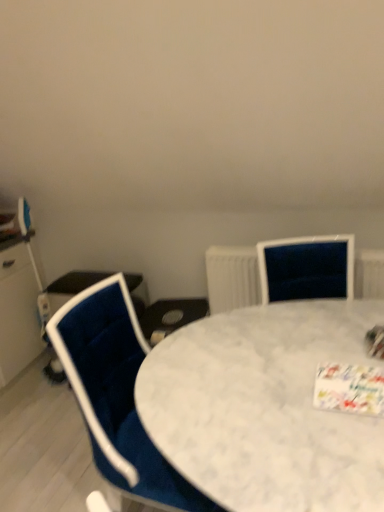
Question: From the image's perspective, is velvet blue chair at left on white marble table at center?

Choices:
 (A) no
 (B) yes

Answer: (B)

Question: From a real-world perspective, is velvet blue chair at left physically below white marble table at center?

Choices:
 (A) no
 (B) yes

Answer: (A)

Question: Can you confirm if velvet blue chair at left is thinner than white marble table at center?

Choices:
 (A) yes
 (B) no

Answer: (A)

Question: Is velvet blue chair at left further to camera compared to white marble table at center?

Choices:
 (A) no
 (B) yes

Answer: (B)

Question: Can you confirm if velvet blue chair at left is bigger than white marble table at center?

Choices:
 (A) no
 (B) yes

Answer: (A)

Question: Based on their sizes in the image, would you say white marble table at center is bigger or smaller than white textured radiator at upper right?

Choices:
 (A) small
 (B) big

Answer: (B)

Question: From a real-world perspective, is white marble table at center above or below white textured radiator at upper right?

Choices:
 (A) above
 (B) below

Answer: (B)

Question: Considering the positions of white marble table at center and white textured radiator at upper right in the image, is white marble table at center taller or shorter than white textured radiator at upper right?

Choices:
 (A) short
 (B) tall

Answer: (B)

Question: Considering the positions of white marble table at center and white textured radiator at upper right in the image, is white marble table at center wider or thinner than white textured radiator at upper right?

Choices:
 (A) thin
 (B) wide

Answer: (B)

Question: Is velvet blue chair at left spatially inside white marble table at center, or outside of it?

Choices:
 (A) inside
 (B) outside

Answer: (A)

Question: Looking at their shapes, would you say velvet blue chair at left is wider or thinner than white marble table at center?

Choices:
 (A) wide
 (B) thin

Answer: (B)

Question: Looking at the image, does velvet blue chair at left seem bigger or smaller compared to white marble table at center?

Choices:
 (A) small
 (B) big

Answer: (A)

Question: In the image, is velvet blue chair at left positioned in front of or behind white marble table at center?

Choices:
 (A) behind
 (B) front

Answer: (A)

Question: Is white textured radiator at upper right wider or thinner than velvet blue chair at left?

Choices:
 (A) wide
 (B) thin

Answer: (B)

Question: In the image, is white textured radiator at upper right on the left side or the right side of velvet blue chair at left?

Choices:
 (A) left
 (B) right

Answer: (B)